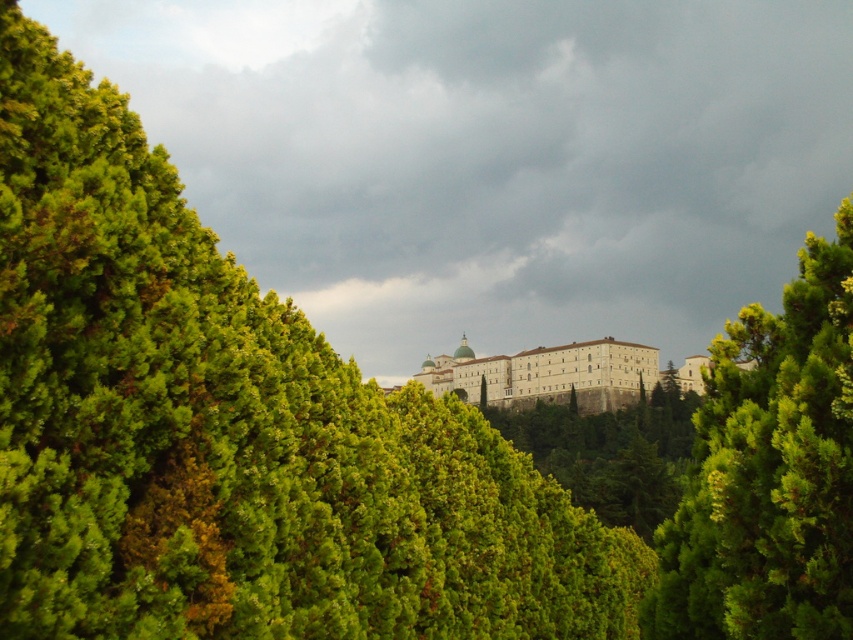
Who is higher up, dark gray cloud at upper center or white stone building at center?

dark gray cloud at upper center is above.

Can you confirm if dark gray cloud at upper center is smaller than white stone building at center?

Incorrect, dark gray cloud at upper center is not smaller in size than white stone building at center.

This screenshot has width=853, height=640. What are the coordinates of `dark gray cloud at upper center` in the screenshot? It's located at (492, 156).

Is dark gray cloud at upper center bigger than green leafy tree at right?

Yes.

Who is shorter, dark gray cloud at upper center or green leafy tree at right?

Standing shorter between the two is green leafy tree at right.

Locate an element on the screen. Image resolution: width=853 pixels, height=640 pixels. dark gray cloud at upper center is located at coordinates (492, 156).

Is point (722, 493) farther from camera compared to point (498, 372)?

No, it is in front of (498, 372).

Looking at this image, can you confirm if green leafy tree at right is thinner than white stone building at center?

Indeed, green leafy tree at right has a lesser width compared to white stone building at center.

Is point (849, 456) closer to viewer compared to point (469, 346)?

That is True.

Locate an element on the screen. The height and width of the screenshot is (640, 853). green leafy tree at right is located at coordinates (769, 472).